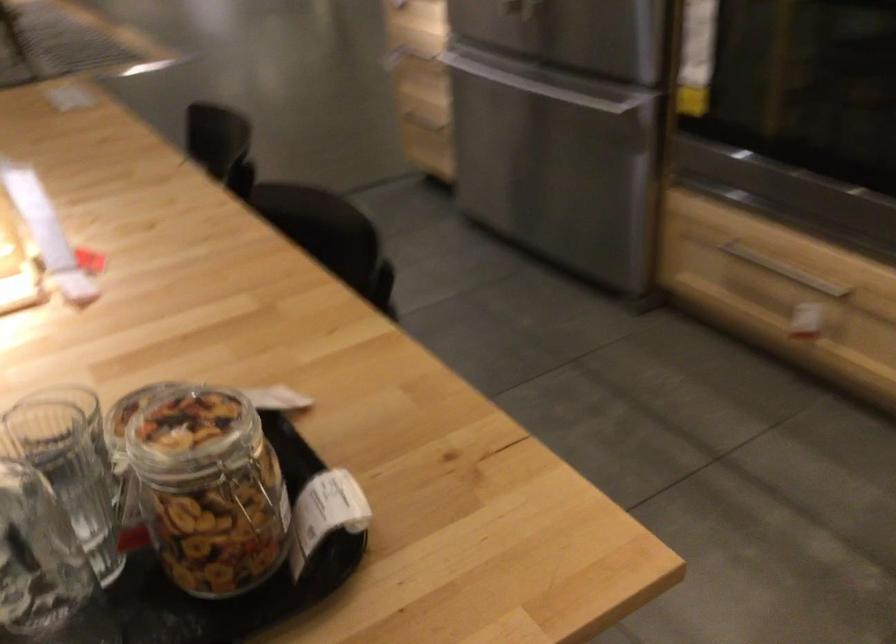
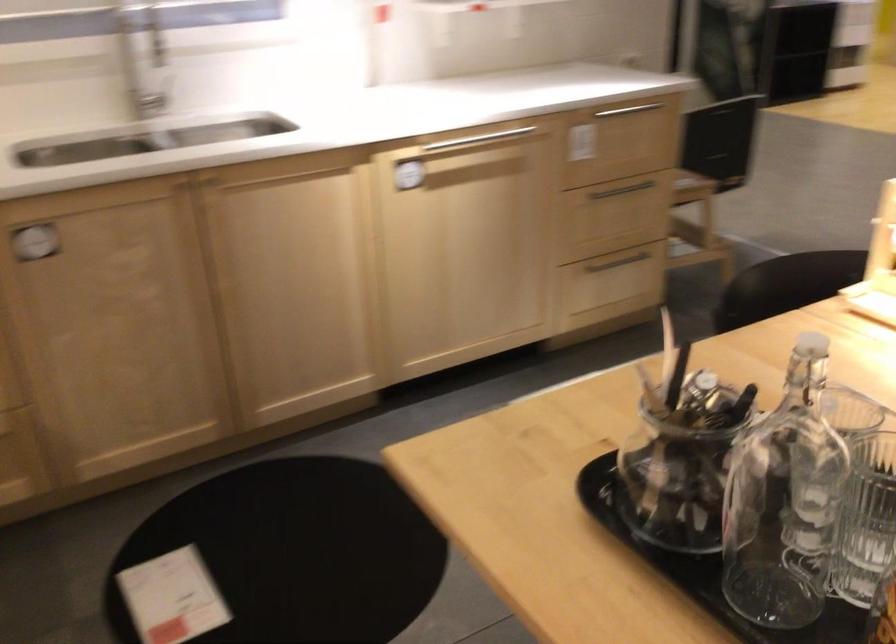
Based on the continuous images, in which direction is the camera rotating?

The camera's rotation is toward left-down.